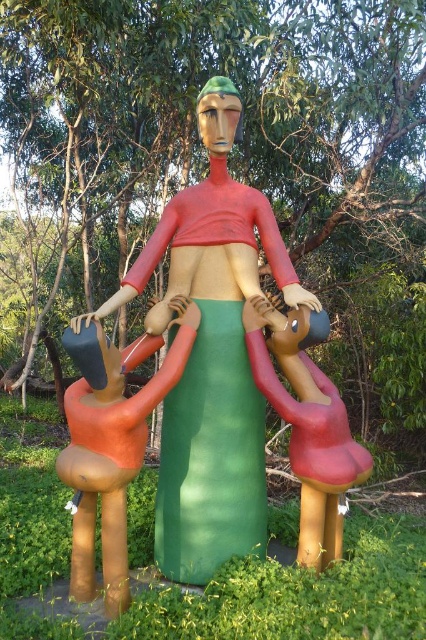
Does matte green dress at center have a lesser width compared to matte orange figure at lower left?

No, matte green dress at center is not thinner than matte orange figure at lower left.

Is matte green dress at center in front of matte orange figure at lower left?

No, matte green dress at center is behind matte orange figure at lower left.

Which is behind, point (236, 516) or point (86, 570)?

Point (236, 516)

You are a GUI agent. You are given a task and a screenshot of the screen. Output one action in this format:
    pyautogui.click(x=<x>, y=<y>)
    Task: Click on the matte green dress at center
    This screenshot has width=426, height=640.
    Given the screenshot: What is the action you would take?
    pyautogui.click(x=212, y=355)

Is matte orange figure at lower left taller than matte red figure at center?

Indeed, matte orange figure at lower left has a greater height compared to matte red figure at center.

Does matte orange figure at lower left appear on the left side of matte red figure at center?

Correct, you'll find matte orange figure at lower left to the left of matte red figure at center.

Is point (146, 429) positioned before point (275, 353)?

Yes, it is.

Image resolution: width=426 pixels, height=640 pixels. Find the location of `matte orange figure at lower left`. matte orange figure at lower left is located at coordinates (109, 451).

Does matte green dress at center appear on the left side of matte red figure at center?

Correct, you'll find matte green dress at center to the left of matte red figure at center.

Which is behind, point (181, 205) or point (316, 388)?

The point (181, 205) is behind.

Find the location of `matte green dress at center`. matte green dress at center is located at coordinates (212, 355).